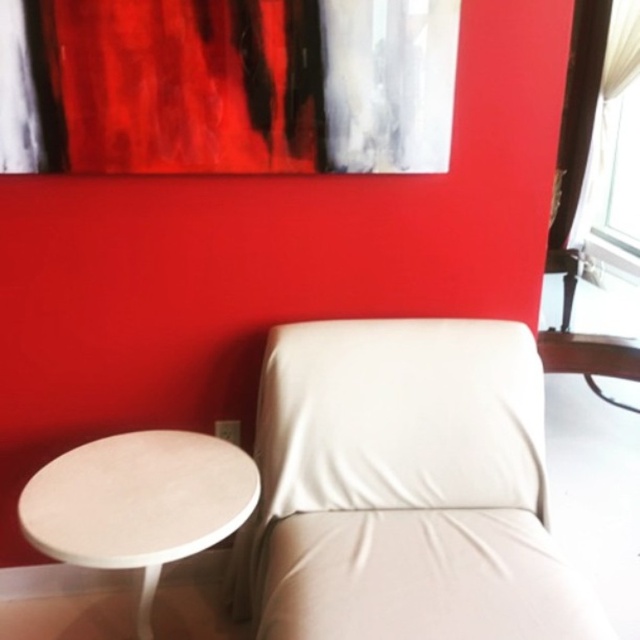
You are a guest entering the room and want to sit down comfortably. Which object, the white leather armchair at lower right or the white matte table at lower left, is more suitable for sitting?

The white leather armchair at lower right is more suitable for sitting because it has a greater height compared to the white matte table at lower left, making it more comfortable for sitting.

You are planning to place a new rectangular coffee table in the center of the room. The coffee table is 1.2 meters wide. Considering the white leather armchair at lower right and the white matte table at lower left, which object has enough space to accommodate the coffee table between them?

The white leather armchair at lower right has a larger width than the white matte table at lower left. Since the coffee table is 1.2 meters wide, it can only fit between the two objects if the distance between them is at least 1.2 meters. However, the question does not provide information about the distance between the two objects, so we cannot determine which object has enough space to accommodate the coffee table between them based on the given information.

You are standing in the center of the room and want to move to the white leather armchair at lower right. According to the coordinates provided, in which direction should you move?

The white leather armchair at lower right is located at coordinates point (404, 486). Since you are at the center, you should move towards the lower right direction to reach it.